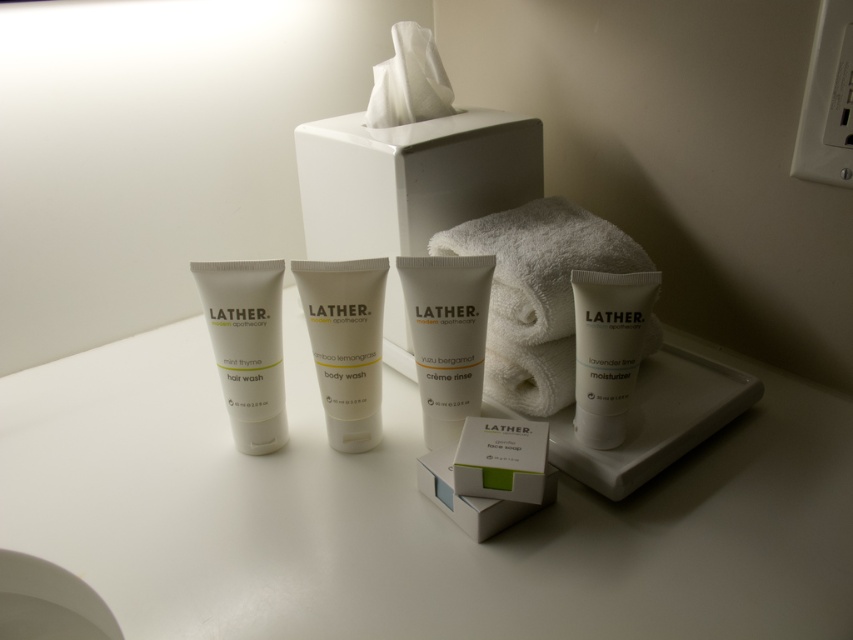
You are standing in front of the bathroom counter with the LATHER products. There are two points marked on the counter. Which point is closer to you, point (233, 358) or point (514, 456)?

Point (233, 358) is closer to you because it is further to the viewer than point (514, 456).

You are organizing the bathroom counter and need to place the white matte tissue box at center and the white matte creme rinse at center. According to the arrangement shown, which item should be placed to the left of the other?

The white matte tissue box at center should be placed to the left of the white matte creme rinse at center because the description states that the tissue box is positioned on the left side of the creme rinse.

You are organizing the toiletries on the bathroom counter and need to place a new item exactly where the white matte creme rinse at center is located. What are the coordinates of that spot?

The coordinates of the spot where the white matte creme rinse at center is located are at point (445, 337).